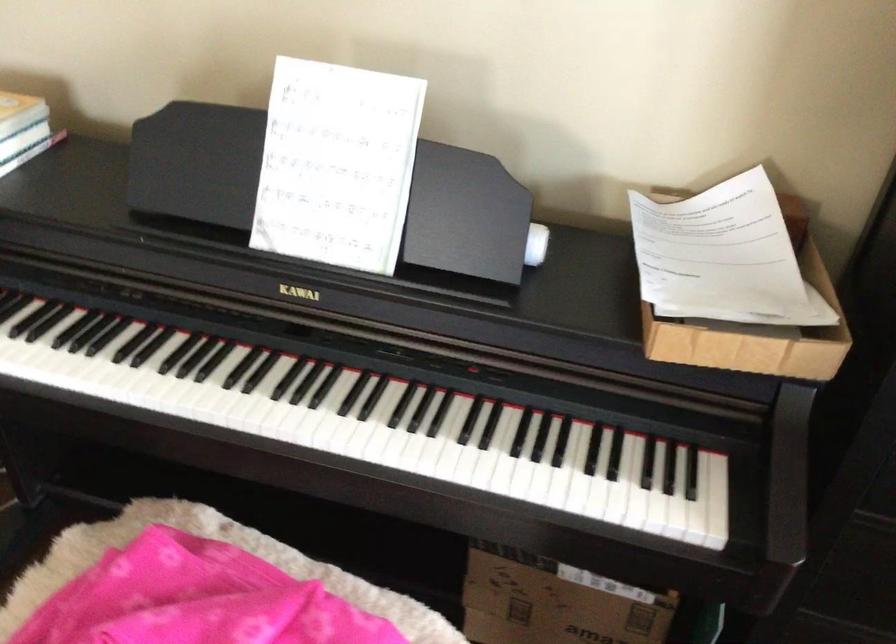
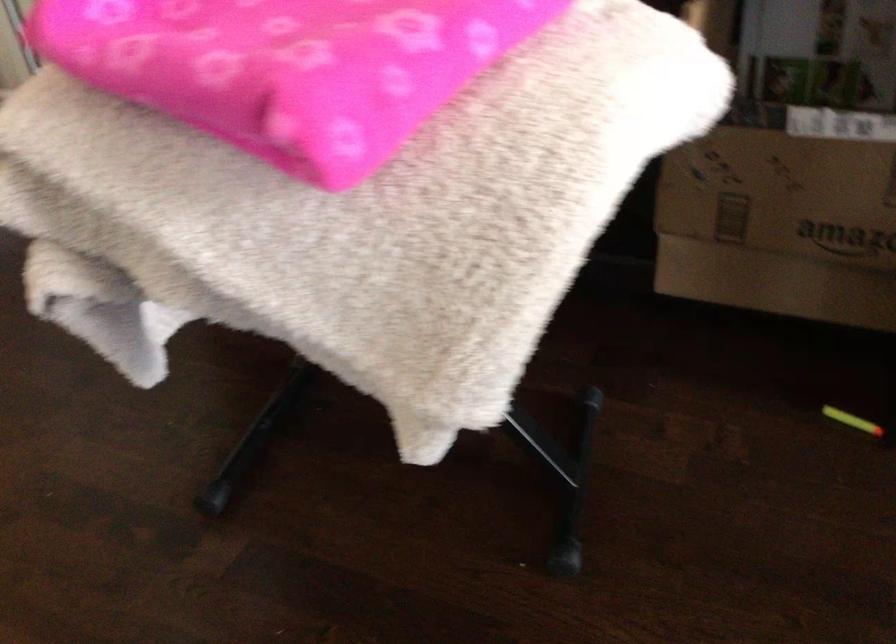
Question: The camera is either moving clockwise (left) or counter-clockwise (right) around the object. The first image is from the beginning of the video and the second image is from the end. Is the camera moving left or right when shooting the video?

Choices:
 (A) Left
 (B) Right

Answer: (B)